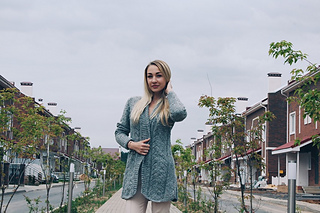
The width and height of the screenshot is (320, 213). Identify the location of floor. (112, 204).